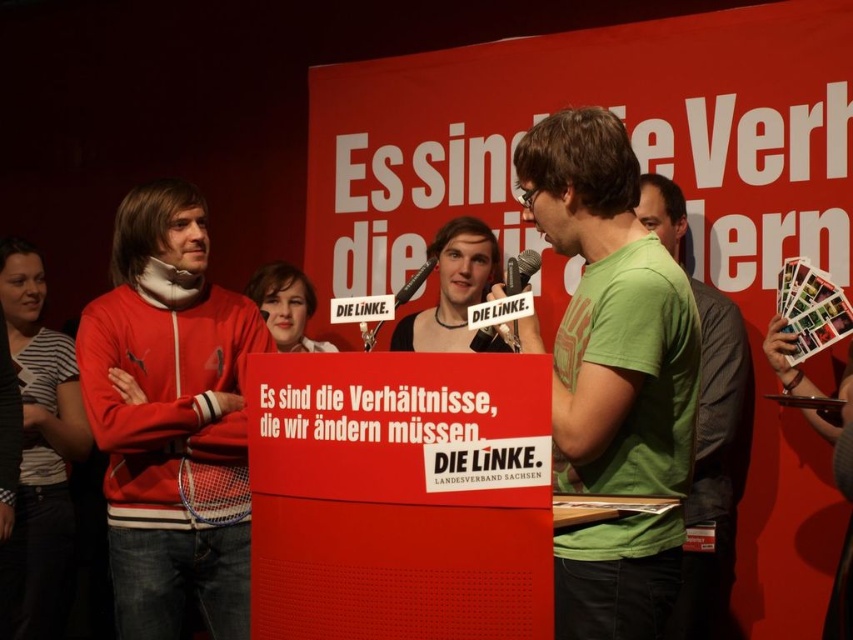
Consider the image. You are standing at the event and want to take a photo of the red banner with the slogan. The banner is located at point [177,579]. If you are 2.41 meters away from this point, is the distance sufficient to capture the entire banner in your camera frame?

The distance between you and the red banner at point [177,579] is 2.41 meters. Whether this is sufficient depends on your camera lens and framing, but the provided information does not specify camera details. However, the banner is part of the scene described, so you can attempt to take the photo from that distance.